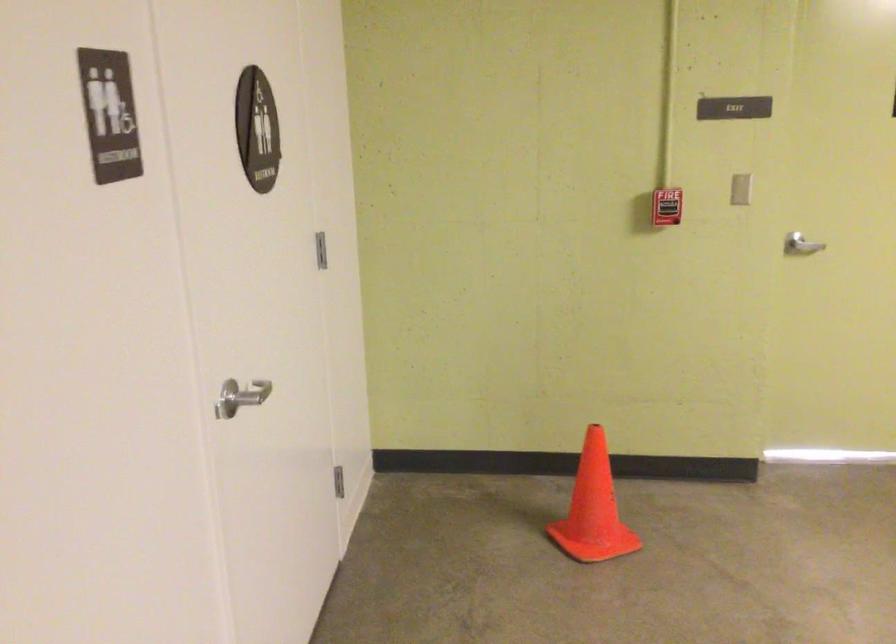
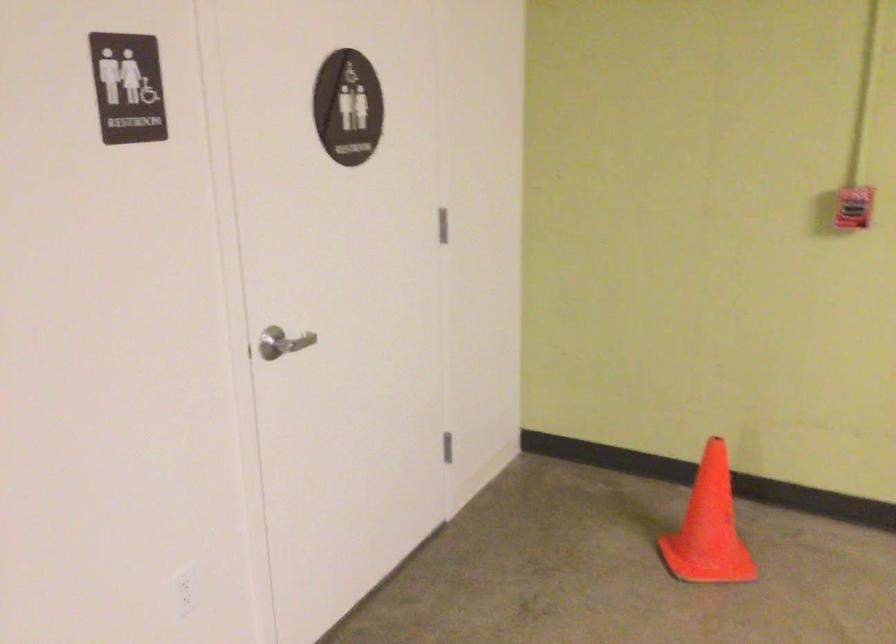
Question: In a continuous first-person perspective shot, in which direction is the camera moving?

Choices:
 (A) Left
 (B) Right
 (C) Forward
 (D) Backward

Answer: (B)